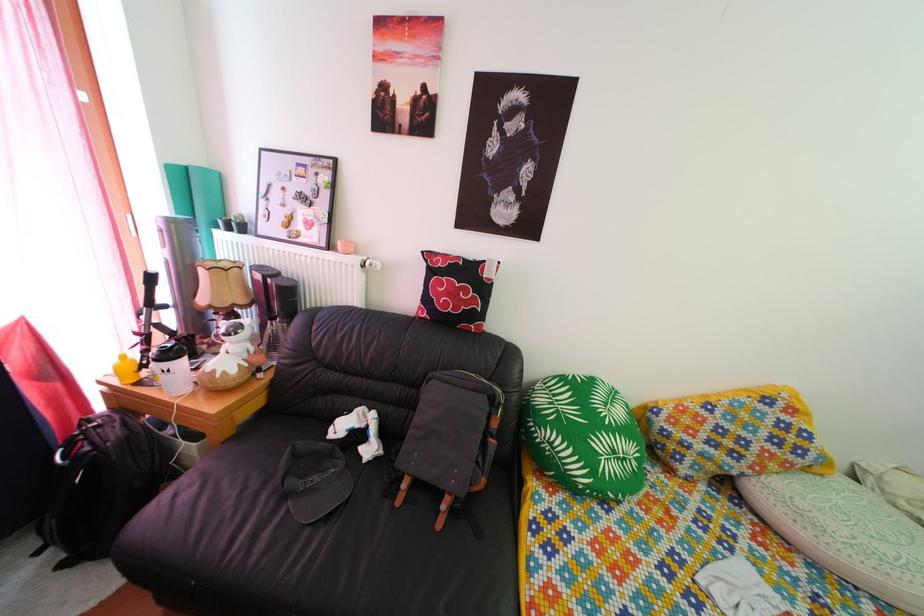
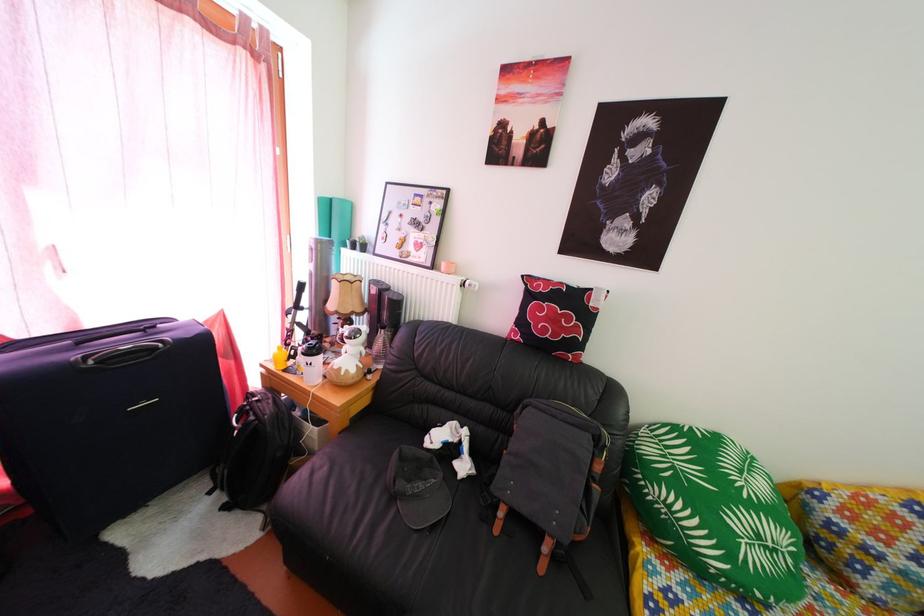
Find the pixel in the second image that matches [261,358] in the first image.

(372, 361)